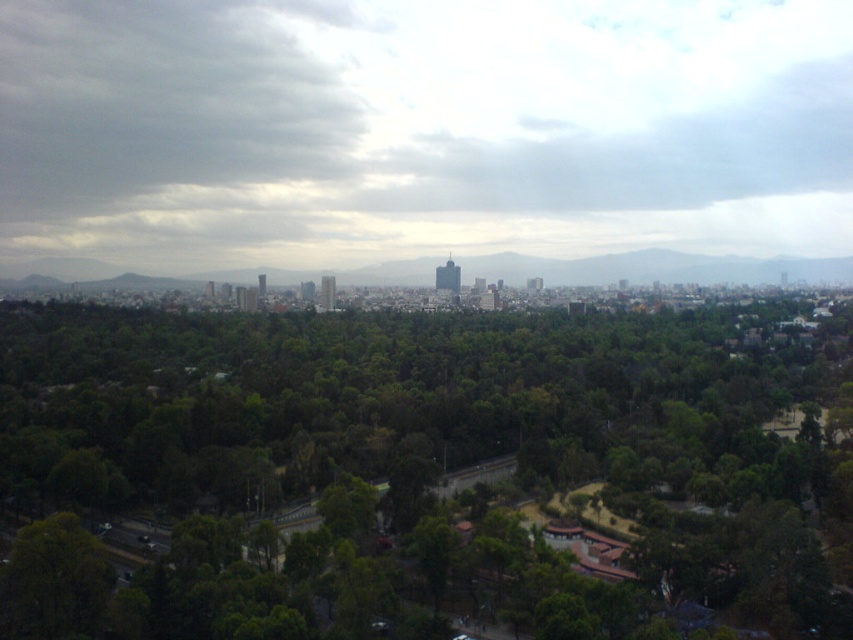
Question: Among these points, which one is farthest from the camera?

Choices:
 (A) (827, 260)
 (B) (239, 451)

Answer: (A)

Question: Is green leafy trees at center wider than gray/bluish stone mountains at center?

Choices:
 (A) yes
 (B) no

Answer: (B)

Question: From the image, what is the correct spatial relationship of green leafy trees at center in relation to gray/bluish stone mountains at center?

Choices:
 (A) below
 (B) above

Answer: (A)

Question: Can you confirm if green leafy trees at center is positioned to the left of gray/bluish stone mountains at center?

Choices:
 (A) no
 (B) yes

Answer: (B)